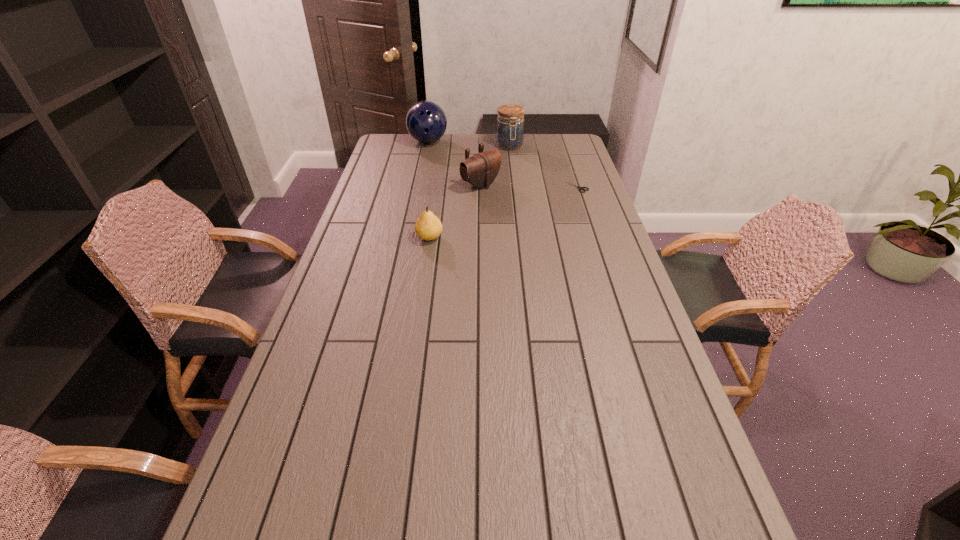
At what (x,y) coordinates should I click in order to perform the action: click on free point between the bowling ball and the nearest object. Please return your answer as a coordinate pair (x, y). The image size is (960, 540). Looking at the image, I should click on (429, 190).

Where is `empty space that is in between the bowling ball and the pouch`? empty space that is in between the bowling ball and the pouch is located at coordinates (x=454, y=164).

Image resolution: width=960 pixels, height=540 pixels. In order to click on free space that is in between the second shortest object and the pouch in this screenshot , I will do `click(455, 211)`.

In order to click on blank region between the bowling ball and the fourth tallest object in this screenshot , I will do `click(429, 190)`.

Locate an element on the screen. free space that is in between the shortest object and the jar is located at coordinates coord(542,166).

The height and width of the screenshot is (540, 960). I want to click on empty space between the nearest object and the shears, so click(503, 212).

Locate an element on the screen. The height and width of the screenshot is (540, 960). the third closest object to the bowling ball is located at coordinates (580, 188).

Where is `object that is the closest to the jar`? Image resolution: width=960 pixels, height=540 pixels. object that is the closest to the jar is located at coordinates (480, 170).

You are a GUI agent. You are given a task and a screenshot of the screen. Output one action in this format:
    pyautogui.click(x=<x>, y=<y>)
    Task: Click on the vacant space that satisfies the following two spatial constraints: 1. on the front side of the jar; 2. on the right side of the bowling ball
    This screenshot has width=960, height=540.
    Given the screenshot: What is the action you would take?
    pyautogui.click(x=427, y=146)

This screenshot has width=960, height=540. In order to click on free region that satisfies the following two spatial constraints: 1. on the back side of the jar; 2. on the left side of the second shortest object in this screenshot , I will do `click(443, 146)`.